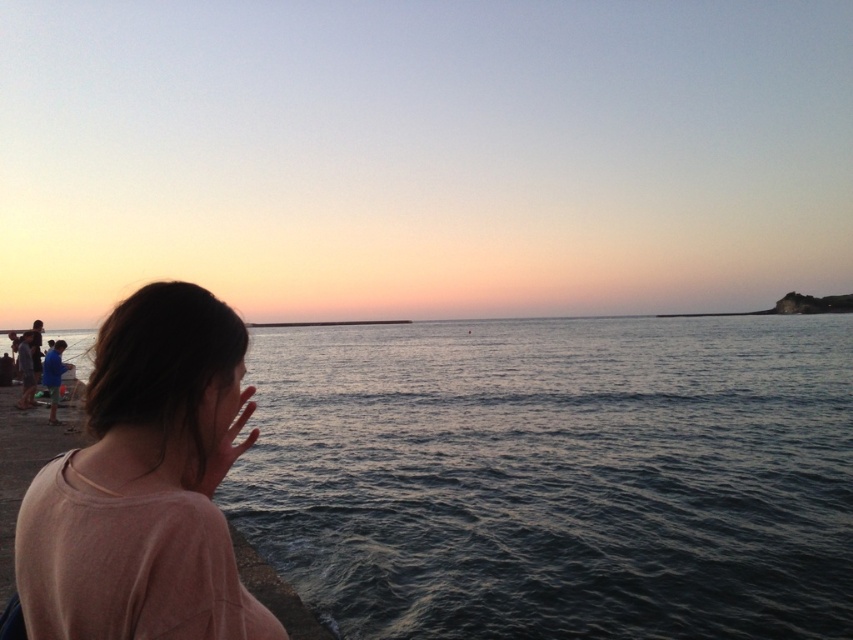
Question: Does smooth water at center have a smaller size compared to pink cotton shirt at lower left?

Choices:
 (A) yes
 (B) no

Answer: (B)

Question: In this image, where is smooth water at center located relative to pink cotton shirt at lower left?

Choices:
 (A) below
 (B) above

Answer: (A)

Question: Which object is closer to the camera taking this photo?

Choices:
 (A) smooth water at center
 (B) pink cotton shirt at lower left

Answer: (B)

Question: Which point appears farthest from the camera in this image?

Choices:
 (A) (33, 481)
 (B) (456, 566)

Answer: (B)

Question: Does smooth water at center appear over pink cotton shirt at lower left?

Choices:
 (A) no
 (B) yes

Answer: (A)